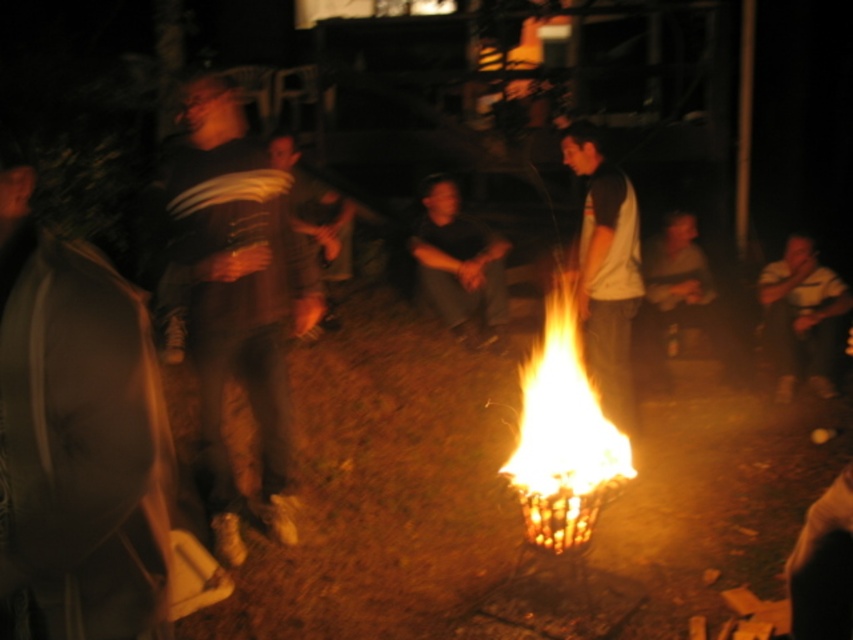
Between flamewoodenbasket at center and white cotton shirt at center, which one has less height?

flamewoodenbasket at center

Does flamewoodenbasket at center lie behind white cotton shirt at center?

No.

Is point (561, 497) positioned after point (593, 369)?

That is False.

I want to click on flamewoodenbasket at center, so click(x=563, y=436).

Can you confirm if black matte shirt at center is thinner than dark gray shirt at center?

Yes.

Consider the image. Is black matte shirt at center below dark gray shirt at center?

No, black matte shirt at center is not below dark gray shirt at center.

Measure the distance between black matte shirt at center and camera.

They are 6.42 meters apart.

You are a GUI agent. You are given a task and a screenshot of the screen. Output one action in this format:
    pyautogui.click(x=<x>, y=<y>)
    Task: Click on the black matte shirt at center
    Image resolution: width=853 pixels, height=640 pixels.
    Given the screenshot: What is the action you would take?
    pyautogui.click(x=457, y=260)

Who is shorter, dark brown leather shoes at left or white cotton shirt at center?

white cotton shirt at center is shorter.

Can you confirm if dark brown leather shoes at left is smaller than white cotton shirt at center?

Incorrect, dark brown leather shoes at left is not smaller in size than white cotton shirt at center.

Locate an element on the screen. dark brown leather shoes at left is located at coordinates (239, 296).